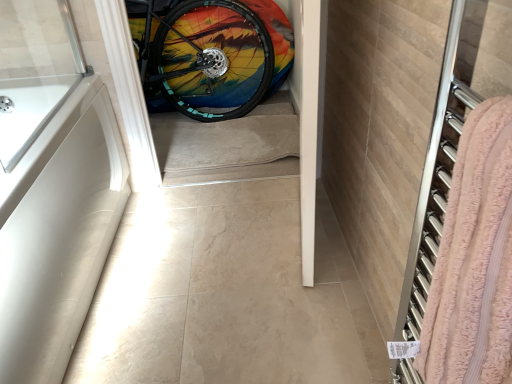
The width and height of the screenshot is (512, 384). I want to click on white matte bathtub at left, so click(x=58, y=233).

Find the location of `pink terry cloth towel at right`. pink terry cloth towel at right is located at coordinates (474, 259).

Image resolution: width=512 pixels, height=384 pixels. Identify the location of white matte bathtub at left. (58, 233).

In the image, is rainbow painted tire at center on the left side or the right side of white matte bathtub at left?

rainbow painted tire at center is positioned on white matte bathtub at left's right side.

How different are the orientations of rainbow painted tire at center and white matte bathtub at left in degrees?

rainbow painted tire at center and white matte bathtub at left are facing 90.4 degrees away from each other.

Are rainbow painted tire at center and white matte bathtub at left beside each other?

rainbow painted tire at center is not next to white matte bathtub at left, and they're not touching.

In the image, is pink terry cloth towel at right positioned in front of or behind white matte bathtub at left?

Visually, pink terry cloth towel at right is located in front of white matte bathtub at left.

Would you say pink terry cloth towel at right is to the left or to the right of white matte bathtub at left in the picture?

In the image, pink terry cloth towel at right appears on the right side of white matte bathtub at left.

Is pink terry cloth towel at right shorter than white matte bathtub at left?

Correct, pink terry cloth towel at right is not as tall as white matte bathtub at left.

Is pink terry cloth towel at right next to white matte bathtub at left?

There is a gap between pink terry cloth towel at right and white matte bathtub at left.

Considering the sizes of objects white matte bathtub at left and pink terry cloth towel at right in the image provided, who is wider, white matte bathtub at left or pink terry cloth towel at right?

white matte bathtub at left.

Is white matte bathtub at left beside pink terry cloth towel at right?

No, white matte bathtub at left is not next to pink terry cloth towel at right.

From a real-world perspective, which is physically below, white matte bathtub at left or pink terry cloth towel at right?

white matte bathtub at left is physically lower.

Does white matte bathtub at left appear on the left side of pink terry cloth towel at right?

Yes.

Considering the points (120, 193) and (200, 32), which point is in front, point (120, 193) or point (200, 32)?

The point (120, 193) is closer.

From the image's perspective, is white matte bathtub at left over rainbow painted tire at center?

Actually, white matte bathtub at left appears below rainbow painted tire at center in the image.

Is white matte bathtub at left bigger or smaller than rainbow painted tire at center?

Clearly, white matte bathtub at left is larger in size than rainbow painted tire at center.

Who is smaller, rainbow painted tire at center or pink terry cloth towel at right?

Smaller between the two is pink terry cloth towel at right.

Is rainbow painted tire at center beside pink terry cloth towel at right?

No, rainbow painted tire at center is not next to pink terry cloth towel at right.

Who is taller, rainbow painted tire at center or pink terry cloth towel at right?

rainbow painted tire at center is taller.

Could you tell me if rainbow painted tire at center is facing pink terry cloth towel at right?

Yes, rainbow painted tire at center is facing pink terry cloth towel at right.

Between pink terry cloth towel at right and rainbow painted tire at center, which one is positioned in front?

pink terry cloth towel at right is closer to the camera.

Between pink terry cloth towel at right and rainbow painted tire at center, which one has more height?

rainbow painted tire at center.

Are pink terry cloth towel at right and rainbow painted tire at center beside each other?

No.

From the image's perspective, which is above, pink terry cloth towel at right or rainbow painted tire at center?

rainbow painted tire at center.

Locate an element on the screen. The width and height of the screenshot is (512, 384). bicycle wheel positioned vertically above the white matte bathtub at left (from a real-world perspective) is located at coordinates (208, 58).

This screenshot has width=512, height=384. I want to click on bath above the pink terry cloth towel at right (from the image's perspective), so click(58, 233).

Based on their spatial positions, is rainbow painted tire at center or white matte bathtub at left closer to pink terry cloth towel at right?

Based on the image, white matte bathtub at left appears to be nearer to pink terry cloth towel at right.

Consider the image. When comparing their distances from white matte bathtub at left, does rainbow painted tire at center or pink terry cloth towel at right seem further?

Based on the image, rainbow painted tire at center appears to be further to white matte bathtub at left.

Based on their spatial positions, is white matte bathtub at left or rainbow painted tire at center further from pink terry cloth towel at right?

rainbow painted tire at center.

When comparing their distances from rainbow painted tire at center, does pink terry cloth towel at right or white matte bathtub at left seem closer?

The object closer to rainbow painted tire at center is white matte bathtub at left.

Looking at the image, which one is located closer to white matte bathtub at left, pink terry cloth towel at right or rainbow painted tire at center?

pink terry cloth towel at right.

From the image, which object appears to be farther from rainbow painted tire at center, white matte bathtub at left or pink terry cloth towel at right?

pink terry cloth towel at right lies further to rainbow painted tire at center than the other object.

Where is `bath between pink terry cloth towel at right and rainbow painted tire at center along the z-axis`? Image resolution: width=512 pixels, height=384 pixels. bath between pink terry cloth towel at right and rainbow painted tire at center along the z-axis is located at coordinates (58, 233).